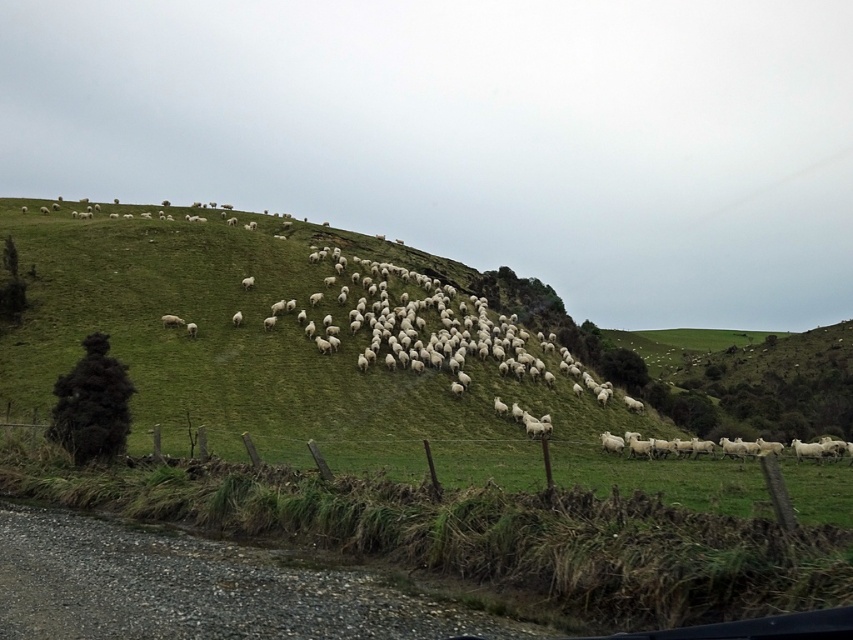
You are standing at the base of the hill in the pastoral scene and want to walk to the point labeled point (x=647, y=488). Which direction should you head relative to the point labeled point (x=190, y=328)?

You should head towards the point labeled point (x=647, y=488) which is closer to you than the point labeled point (x=190, y=328).